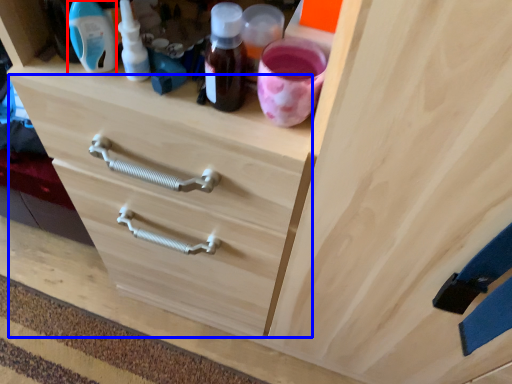
Question: Which point is closer to the camera, bottle (highlighted by a red box) or drawer (highlighted by a blue box)?

Choices:
 (A) bottle
 (B) drawer

Answer: (A)